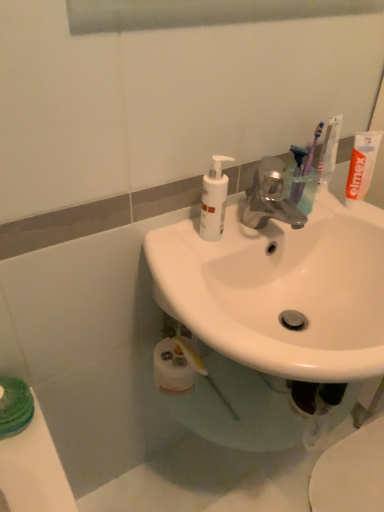
This screenshot has height=512, width=384. Identify the location of vacant area that is situated to the right of white matte pump bottle at upper center. (263, 227).